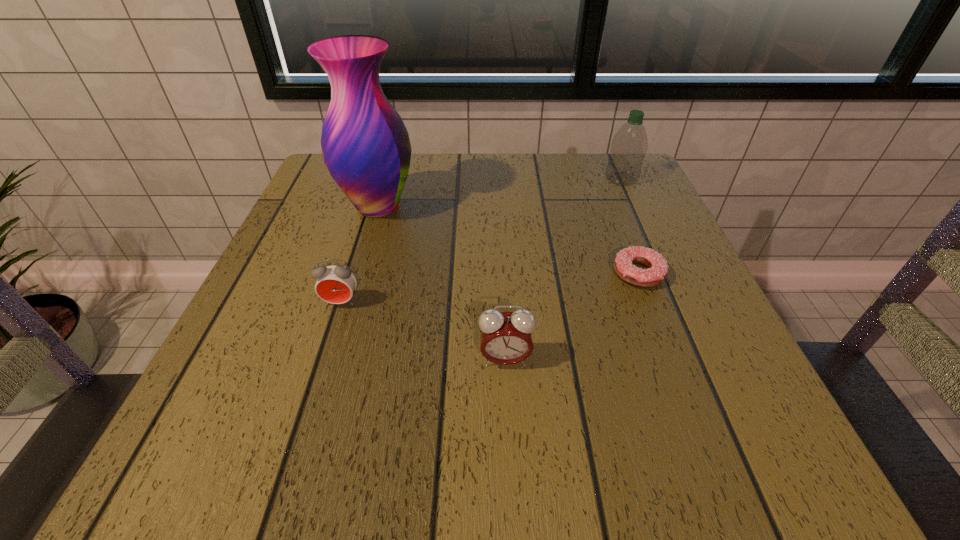
Where is `vacant space located on the clock face of the right alarm clock`? Image resolution: width=960 pixels, height=540 pixels. vacant space located on the clock face of the right alarm clock is located at coordinates (508, 413).

Where is `free spot located on the face of the shorter alarm clock`? free spot located on the face of the shorter alarm clock is located at coordinates (330, 338).

This screenshot has width=960, height=540. I want to click on free space located on the back of the doughnut, so click(x=596, y=164).

This screenshot has height=540, width=960. Identify the location of vase at the far edge. (365, 145).

Where is `water bottle present at the far edge`? This screenshot has width=960, height=540. water bottle present at the far edge is located at coordinates (629, 146).

Where is `vase that is at the left edge`? This screenshot has height=540, width=960. vase that is at the left edge is located at coordinates (365, 145).

Locate an element on the screen. alarm clock present at the left edge is located at coordinates (335, 284).

Where is `water bottle located in the right edge section of the desktop`? The image size is (960, 540). water bottle located in the right edge section of the desktop is located at coordinates (629, 146).

Locate an element on the screen. This screenshot has height=540, width=960. doughnut located in the right edge section of the desktop is located at coordinates (623, 265).

The width and height of the screenshot is (960, 540). I want to click on object that is positioned at the far left corner, so click(365, 145).